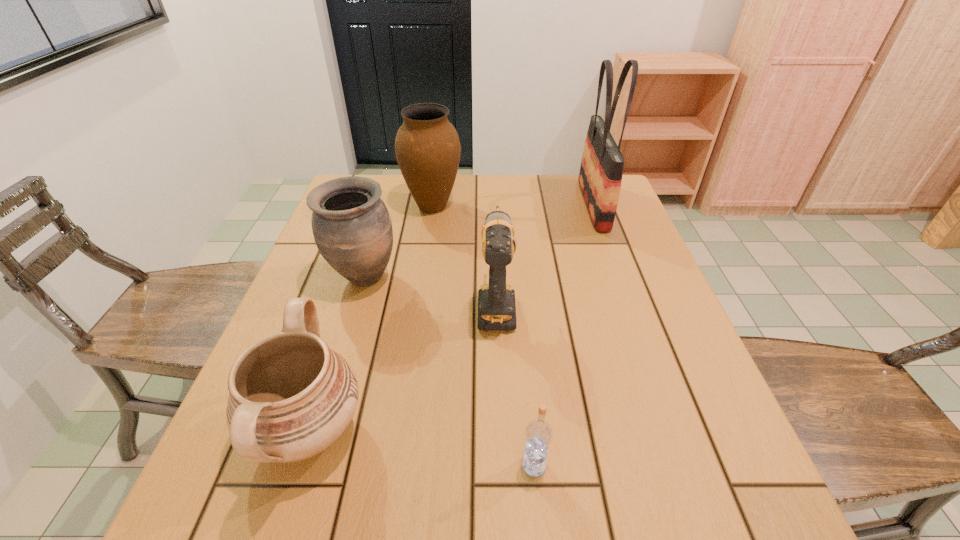
This screenshot has width=960, height=540. Find the location of `vacant area that lies between the drill and the nearest urn`. vacant area that lies between the drill and the nearest urn is located at coordinates (403, 368).

Image resolution: width=960 pixels, height=540 pixels. Identify the location of free space between the drill and the nearest urn. (403, 368).

Find the location of `vacant space in between the second farthest urn and the drill`. vacant space in between the second farthest urn and the drill is located at coordinates (430, 292).

This screenshot has height=540, width=960. I want to click on free spot between the vodka and the rightmost object, so click(x=564, y=335).

At what (x,y) coordinates should I click in order to perform the action: click on vacant point located between the drill and the vodka. Please return your answer as a coordinate pair (x, y). The image size is (960, 540). Looking at the image, I should click on (515, 384).

Image resolution: width=960 pixels, height=540 pixels. Identify the location of vacant area that lies between the shortest object and the rightmost object. (564, 335).

The width and height of the screenshot is (960, 540). What are the coordinates of `blank region between the drill and the nearest urn` in the screenshot? It's located at [x=403, y=368].

I want to click on vacant space that is in between the second farthest urn and the tallest object, so click(479, 241).

Image resolution: width=960 pixels, height=540 pixels. What are the coordinates of `object that stands as the third closest to the nearest urn` in the screenshot? It's located at (538, 433).

Identify which object is the closest to the drill. Please provide its 2D coordinates. Your answer should be formatted as a tuple, i.e. [(x, y)], where the tuple contains the x and y coordinates of a point satisfying the conditions above.

[(352, 228)]